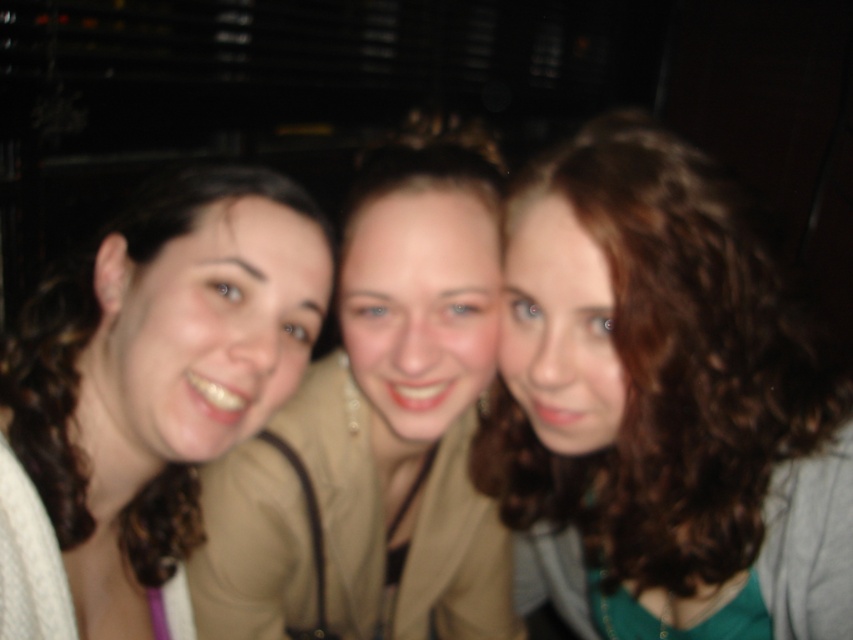
Question: Is curly brown hair at center to the right of matte beige blazer at center from the viewer's perspective?

Choices:
 (A) yes
 (B) no

Answer: (A)

Question: Is the position of curly brown hair at center more distant than that of matte beige blazer at center?

Choices:
 (A) yes
 (B) no

Answer: (B)

Question: Can you confirm if curly brown hair at center is wider than matte beige shirt at left?

Choices:
 (A) no
 (B) yes

Answer: (B)

Question: Which point is closer to the camera taking this photo?

Choices:
 (A) (693, 250)
 (B) (436, 356)
 (C) (282, 388)

Answer: (A)

Question: Based on their relative distances, which object is farther from the matte beige shirt at left?

Choices:
 (A) matte beige blazer at center
 (B) curly brown hair at center

Answer: (B)

Question: Which is nearer to the matte beige shirt at left?

Choices:
 (A) curly brown hair at center
 (B) matte beige blazer at center

Answer: (B)